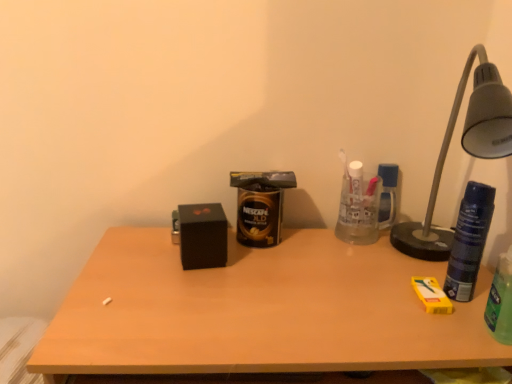
Where is `vacant location behind green plastic bottle at right, the first beverage in the front-to-back sequence`? This screenshot has height=384, width=512. vacant location behind green plastic bottle at right, the first beverage in the front-to-back sequence is located at coordinates (426, 272).